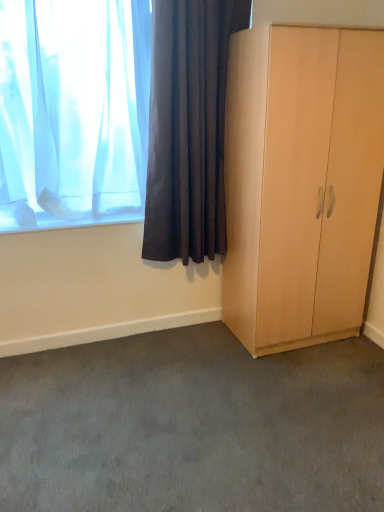
Identify the location of free space above gray carpet at lower center (from a real-world perspective). The width and height of the screenshot is (384, 512). (260, 390).